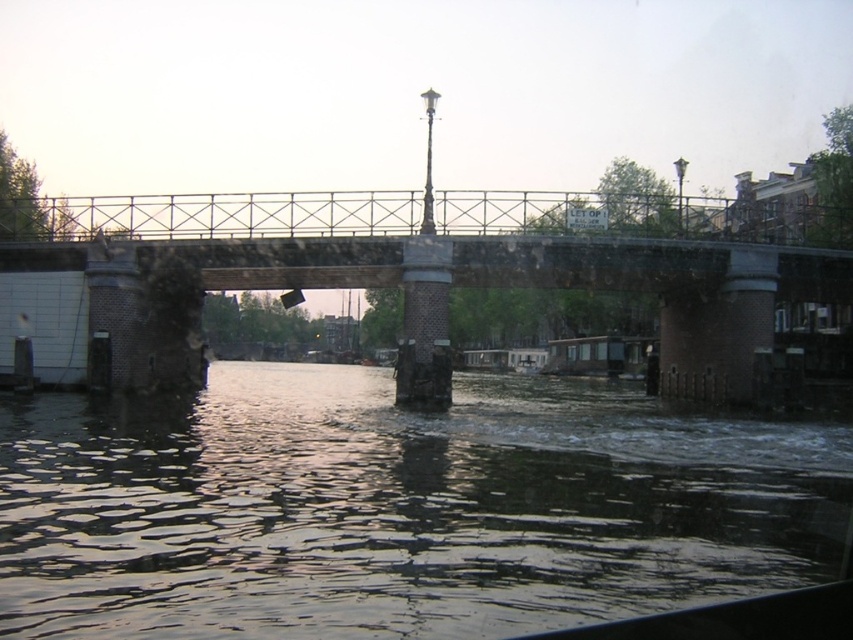
Where is `dark reflective water at center`? dark reflective water at center is located at coordinates (399, 508).

Is dark reflective water at center below rusty metal bridge at center?

Indeed, dark reflective water at center is positioned under rusty metal bridge at center.

This screenshot has height=640, width=853. In order to click on dark reflective water at center in this screenshot , I will do `click(399, 508)`.